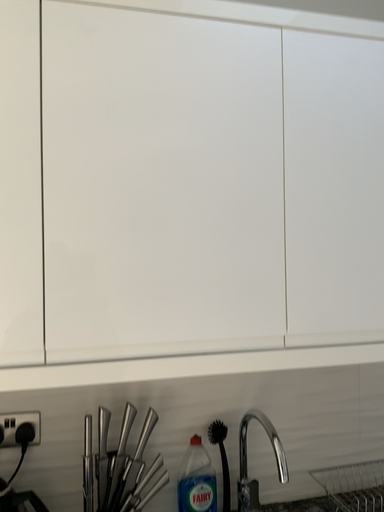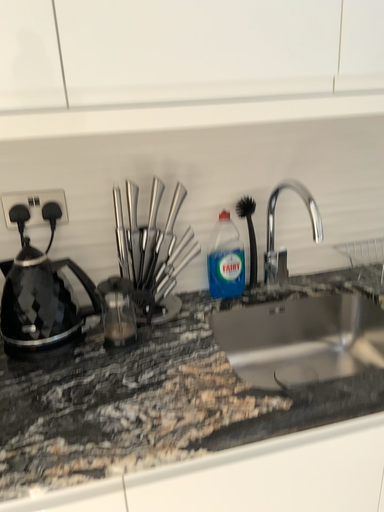
Question: How did the camera likely rotate when shooting the video?

Choices:
 (A) rotated downward
 (B) rotated upward

Answer: (A)